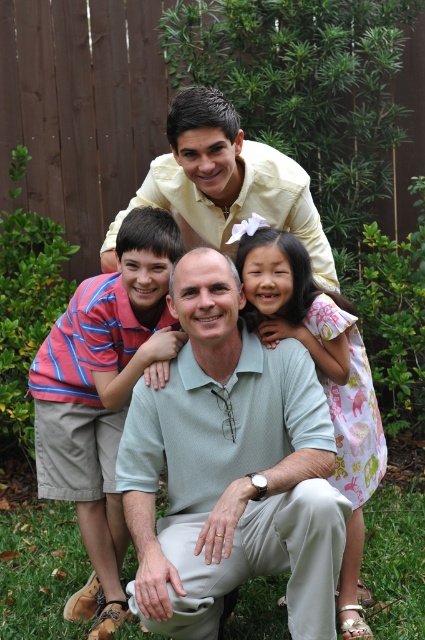
Based on the photo, which of these two, light green textured shirt at center or pink floral dress at upper center, stands taller?

Standing taller between the two is pink floral dress at upper center.

Find the location of `light green textured shirt at center`. light green textured shirt at center is located at coordinates (229, 468).

Describe the element at coordinates (229, 468) in the screenshot. Image resolution: width=425 pixels, height=640 pixels. I see `light green textured shirt at center` at that location.

Who is positioned more to the left, light green textured shirt at center or striped cotton shirt at left?

From the viewer's perspective, striped cotton shirt at left appears more on the left side.

Is point (169, 582) positioned after point (113, 556)?

No, (169, 582) is closer to viewer.

Image resolution: width=425 pixels, height=640 pixels. Identify the location of light green textured shirt at center. (229, 468).

Between pink floral dress at upper center and matte yellow shirt at upper center, which one is positioned higher?

matte yellow shirt at upper center

I want to click on pink floral dress at upper center, so click(320, 376).

Where is `pink floral dress at upper center`? Image resolution: width=425 pixels, height=640 pixels. pink floral dress at upper center is located at coordinates pyautogui.click(x=320, y=376).